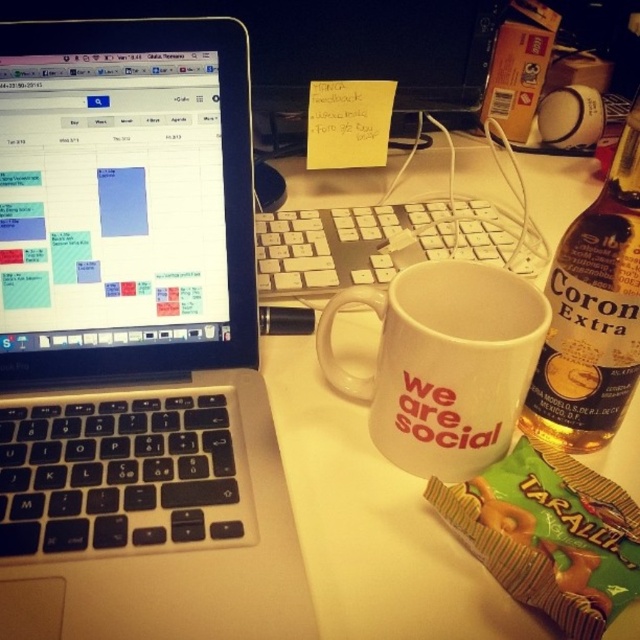
Question: Does white plastic table at center lie in front of translucent glass bottle at right?

Choices:
 (A) yes
 (B) no

Answer: (A)

Question: Which point is farther from the camera taking this photo?

Choices:
 (A) (305, 556)
 (B) (324, 252)

Answer: (B)

Question: Among these points, which one is farthest from the camera?

Choices:
 (A) (301, 480)
 (B) (230, 516)
 (C) (470, 244)
 (D) (580, 410)

Answer: (C)

Question: Can you confirm if silver/black plastic laptop at upper left is positioned below white matte mug at center?

Choices:
 (A) no
 (B) yes

Answer: (A)

Question: Does translucent glass bottle at right appear on the left side of white plastic keyboard at center?

Choices:
 (A) yes
 (B) no

Answer: (B)

Question: Which point appears closest to the camera in this image?

Choices:
 (A) (435, 522)
 (B) (577, 342)
 (C) (433, 449)

Answer: (A)